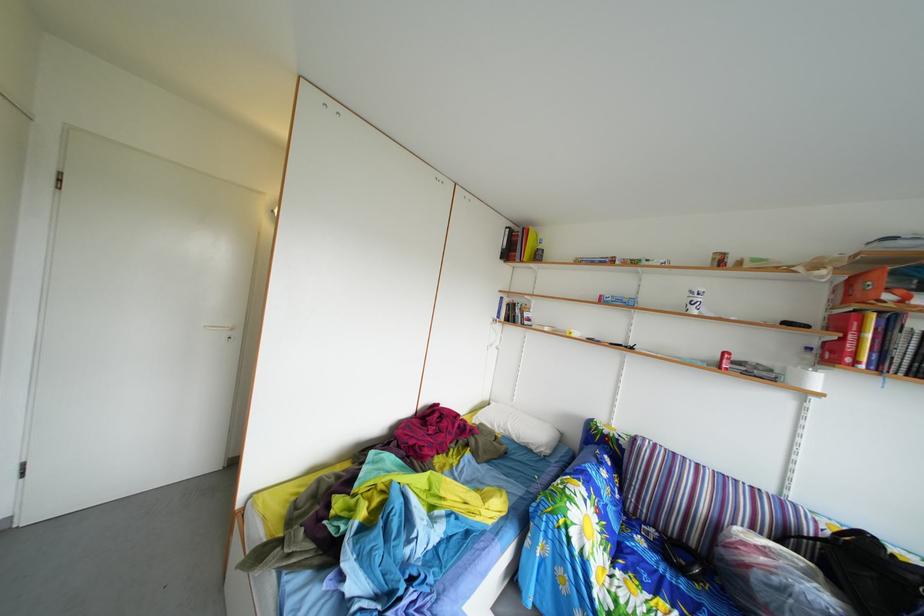
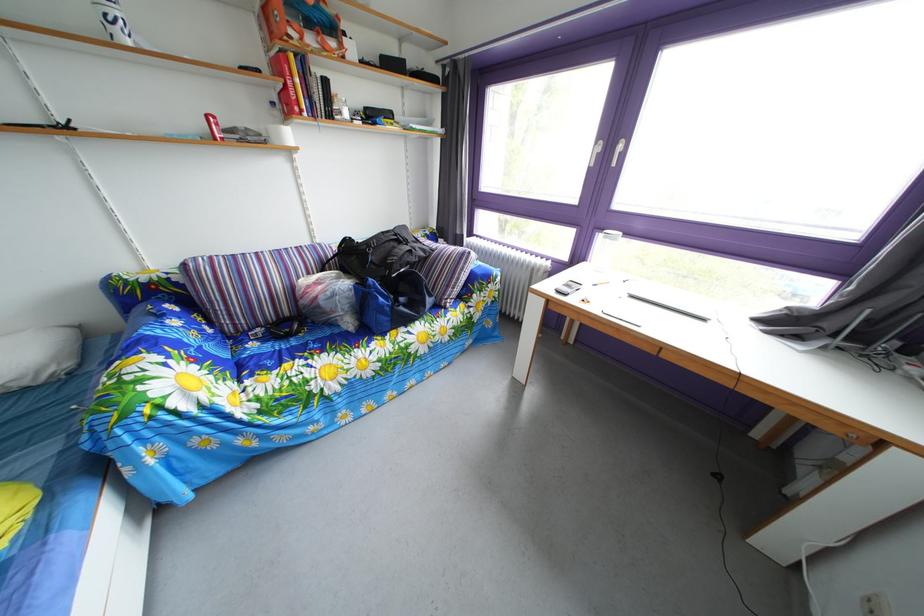
Where in the second image is the point corresponding to point 650,548 from the first image?

(262, 353)